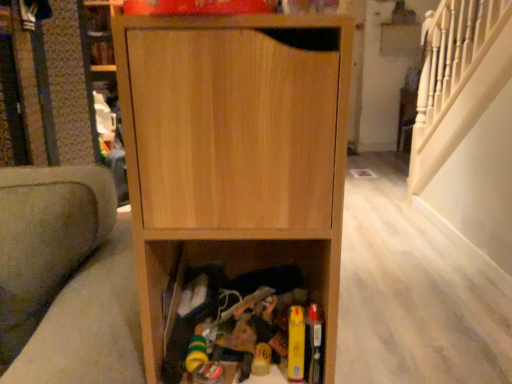
What do you see at coordinates (68, 277) in the screenshot?
I see `soft gray fabric armchair at left` at bounding box center [68, 277].

Where is `soft gray fabric armchair at left`? soft gray fabric armchair at left is located at coordinates (68, 277).

Measure the distance between point (99, 249) and camera.

Point (99, 249) is 1.12 meters from camera.

I want to click on natural wood cabinet at center, so click(234, 152).

The height and width of the screenshot is (384, 512). What do you see at coordinates (234, 152) in the screenshot?
I see `natural wood cabinet at center` at bounding box center [234, 152].

Locate an element on the screen. The width and height of the screenshot is (512, 384). soft gray fabric armchair at left is located at coordinates (68, 277).

Between soft gray fabric armchair at left and natural wood cabinet at center, which one appears on the left side from the viewer's perspective?

Positioned to the left is soft gray fabric armchair at left.

Considering their positions, is soft gray fabric armchair at left located in front of or behind natural wood cabinet at center?

In the image, soft gray fabric armchair at left appears in front of natural wood cabinet at center.

Is point (75, 179) closer or farther from the camera than point (259, 140)?

Clearly, point (75, 179) is more distant from the camera than point (259, 140).

From the image's perspective, is soft gray fabric armchair at left above or below natural wood cabinet at center?

Based on their image positions, soft gray fabric armchair at left is located beneath natural wood cabinet at center.

Looking at this image, from a real-world perspective, who is located lower, soft gray fabric armchair at left or natural wood cabinet at center?

In real-world perspective, soft gray fabric armchair at left is lower.

Which object is thinner, soft gray fabric armchair at left or natural wood cabinet at center?

Thinner between the two is natural wood cabinet at center.

Considering the relative sizes of soft gray fabric armchair at left and natural wood cabinet at center in the image provided, is soft gray fabric armchair at left taller than natural wood cabinet at center?

Yes, soft gray fabric armchair at left is taller than natural wood cabinet at center.

Considering the relative sizes of soft gray fabric armchair at left and natural wood cabinet at center in the image provided, is soft gray fabric armchair at left bigger than natural wood cabinet at center?

Correct, soft gray fabric armchair at left is larger in size than natural wood cabinet at center.

Looking at this image, can natural wood cabinet at center be found inside soft gray fabric armchair at left?

No, natural wood cabinet at center is located outside of soft gray fabric armchair at left.

Is soft gray fabric armchair at left next to natural wood cabinet at center?

No.

Is soft gray fabric armchair at left aimed at natural wood cabinet at center?

No, soft gray fabric armchair at left is not turned towards natural wood cabinet at center.

How different are the orientations of soft gray fabric armchair at left and natural wood cabinet at center in degrees?

The facing directions of soft gray fabric armchair at left and natural wood cabinet at center are 3 degrees apart.

At what (x,y) coordinates should I click in order to perform the action: click on cabinetry that appears above the soft gray fabric armchair at left (from the image's perspective). Please return your answer as a coordinate pair (x, y). This screenshot has height=384, width=512. Looking at the image, I should click on (234, 152).

Does natural wood cabinet at center appear on the left side of soft gray fabric armchair at left?

In fact, natural wood cabinet at center is to the right of soft gray fabric armchair at left.

Is natural wood cabinet at center behind soft gray fabric armchair at left?

Yes, the depth of natural wood cabinet at center is greater than that of soft gray fabric armchair at left.

Which is closer, (240, 72) or (24, 377)?

Point (240, 72) appears to be closer to the viewer than point (24, 377).

From the image's perspective, is natural wood cabinet at center located beneath soft gray fabric armchair at left?

Actually, natural wood cabinet at center appears above soft gray fabric armchair at left in the image.

From a real-world perspective, is natural wood cabinet at center physically located above or below soft gray fabric armchair at left?

natural wood cabinet at center is situated higher than soft gray fabric armchair at left in the real world.

Considering the sizes of objects natural wood cabinet at center and soft gray fabric armchair at left in the image provided, who is wider, natural wood cabinet at center or soft gray fabric armchair at left?

Wider between the two is soft gray fabric armchair at left.

Consider the image. Between natural wood cabinet at center and soft gray fabric armchair at left, which one has more height?

soft gray fabric armchair at left is taller.

Is natural wood cabinet at center bigger than soft gray fabric armchair at left?

Incorrect, natural wood cabinet at center is not larger than soft gray fabric armchair at left.

Is natural wood cabinet at center positioned beyond the bounds of soft gray fabric armchair at left?

Indeed, natural wood cabinet at center is completely outside soft gray fabric armchair at left.

Based on the photo, is natural wood cabinet at center next to soft gray fabric armchair at left and touching it?

There is a gap between natural wood cabinet at center and soft gray fabric armchair at left.

Is natural wood cabinet at center positioned with its back to soft gray fabric armchair at left?

natural wood cabinet at center is not turned away from soft gray fabric armchair at left.

Looking at this image, measure the distance from natural wood cabinet at center to soft gray fabric armchair at left.

natural wood cabinet at center and soft gray fabric armchair at left are 12.57 inches apart.

The image size is (512, 384). I want to click on armchair below the natural wood cabinet at center (from a real-world perspective), so click(x=68, y=277).

You are a GUI agent. You are given a task and a screenshot of the screen. Output one action in this format:
    pyautogui.click(x=<x>, y=<y>)
    Task: Click on the armchair below the natural wood cabinet at center (from a real-world perspective)
    
    Given the screenshot: What is the action you would take?
    pyautogui.click(x=68, y=277)

The height and width of the screenshot is (384, 512). What are the coordinates of `armchair that is on the left side of natural wood cabinet at center` in the screenshot? It's located at (68, 277).